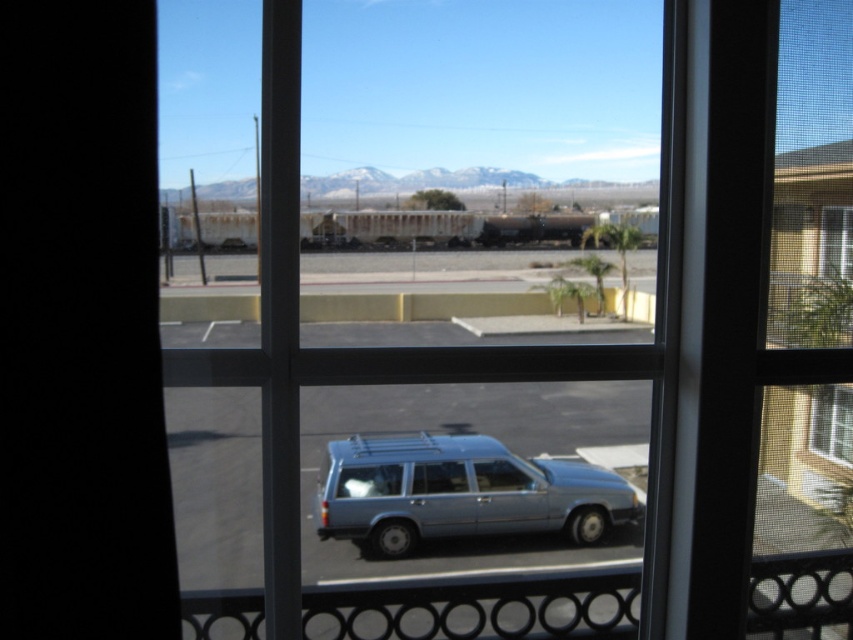
You are standing at the window and want to determine the order of two points marked in the scene. Which point is closer to you, point [289,65] or point [328,456]?

Point [289,65] is in front of point [328,456], so it is closer to you.

You are a delivery drone operator. Your drone has a wingspan of 1.2 meters. You need to fly the drone through the gap between the clear glass window at center and the satin blue station wagon at center. Is there enough space for the drone to pass through this gap?

The gap between the clear glass window at center and the satin blue station wagon at center is 4.43 meters, which is wider than the drone wingspan of 1.2 meters. Yes, the drone can pass through the gap.

You are standing in a room and want to look at the satin blue station wagon at center through the clear glass window at center. Can you see the entire station wagon through the window?

The clear glass window at center is closer to the viewer than the satin blue station wagon at center, so yes, you can see the entire station wagon through the window because the window is positioned in front of the car and not obstructed by any other objects.